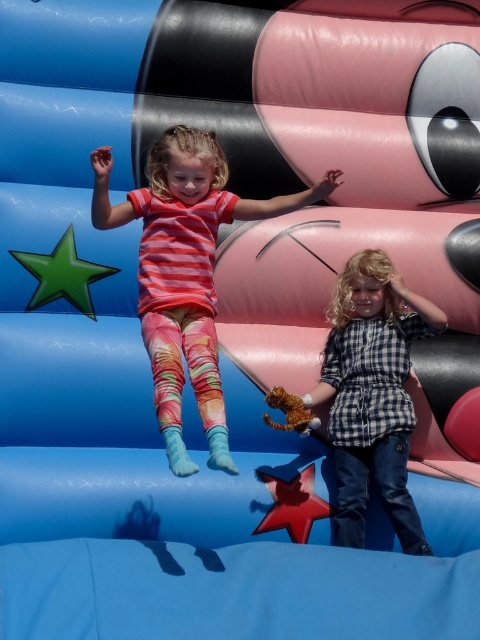
You are standing at the entrance of the bouncy castle and see two points marked on the structure. The first point is at coordinates point (190, 131) and the second is at point (376, 269). Which point is closer to you?

Point (190, 131) is in front of point (376, 269), so it is closer to you.